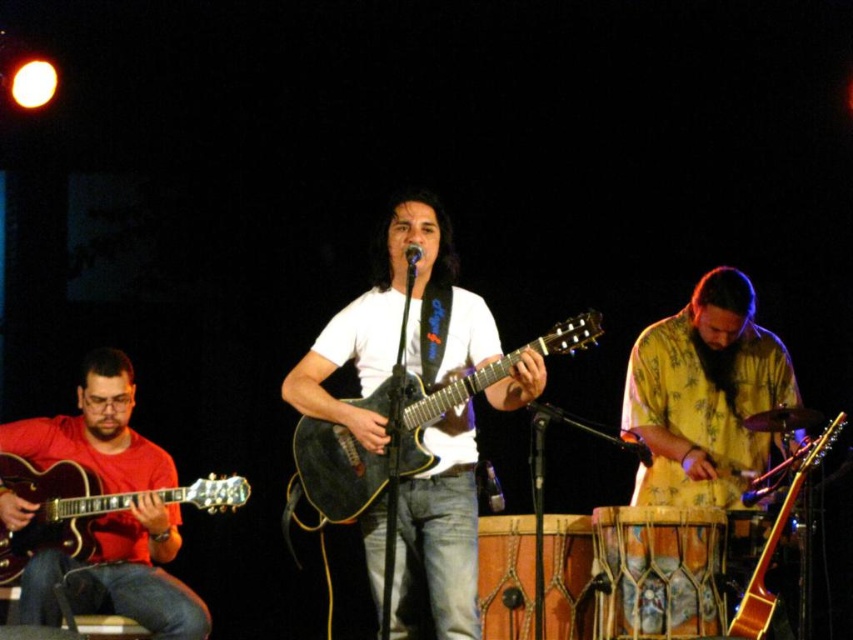
Question: Which of these objects is positioned closest to the glossy wood guitar at center?

Choices:
 (A) black matte microphone at center
 (B) matte black guitar at left
 (C) shiny black electric guitar at left

Answer: (A)

Question: Which of the following is the closest to the observer?

Choices:
 (A) (695, 285)
 (B) (444, 502)

Answer: (B)

Question: Based on their relative distances, which object is nearer to the black matte microphone at center?

Choices:
 (A) glossy black guitar at center
 (B) glossy wood guitar at center
 (C) shiny black electric guitar at left

Answer: (A)

Question: Considering the relative positions of shiny black electric guitar at left and glossy wood guitar at center in the image provided, where is shiny black electric guitar at left located with respect to glossy wood guitar at center?

Choices:
 (A) below
 (B) above

Answer: (B)

Question: Does shiny black electric guitar at left have a smaller size compared to black matte microphone at center?

Choices:
 (A) yes
 (B) no

Answer: (B)

Question: Can you confirm if glossy black guitar at center is thinner than black matte microphone at center?

Choices:
 (A) yes
 (B) no

Answer: (B)